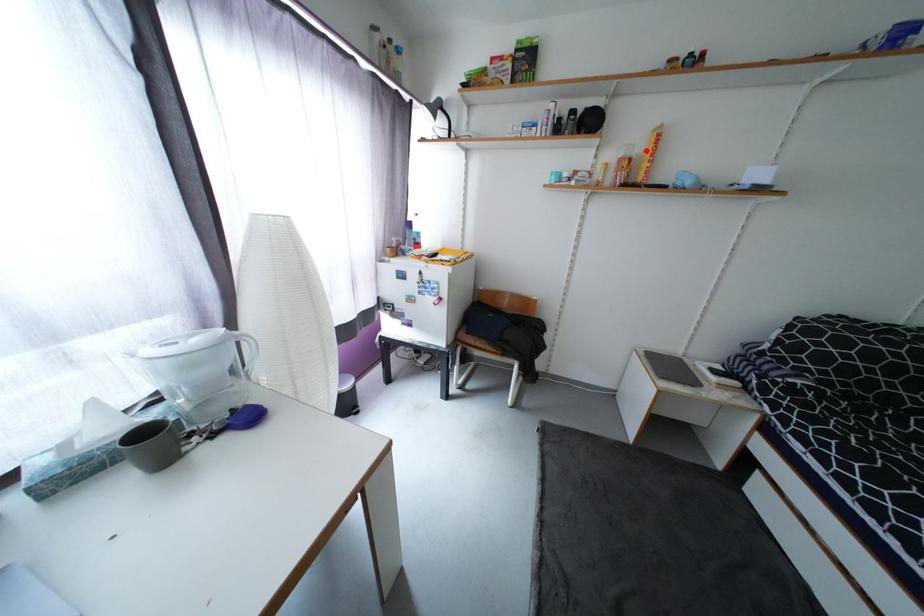
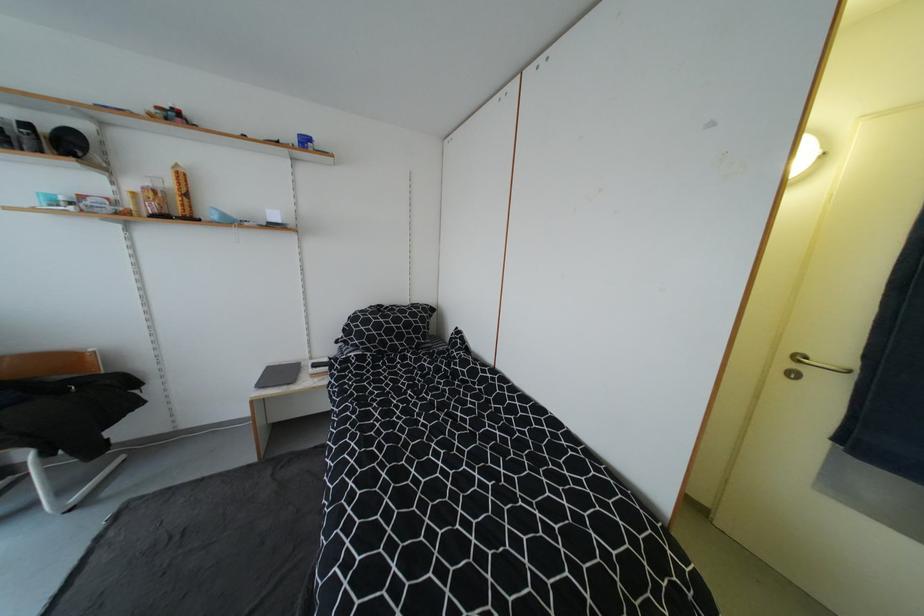
In the second image, find the point that corresponds to the highlighted location in the first image.

(176, 185)